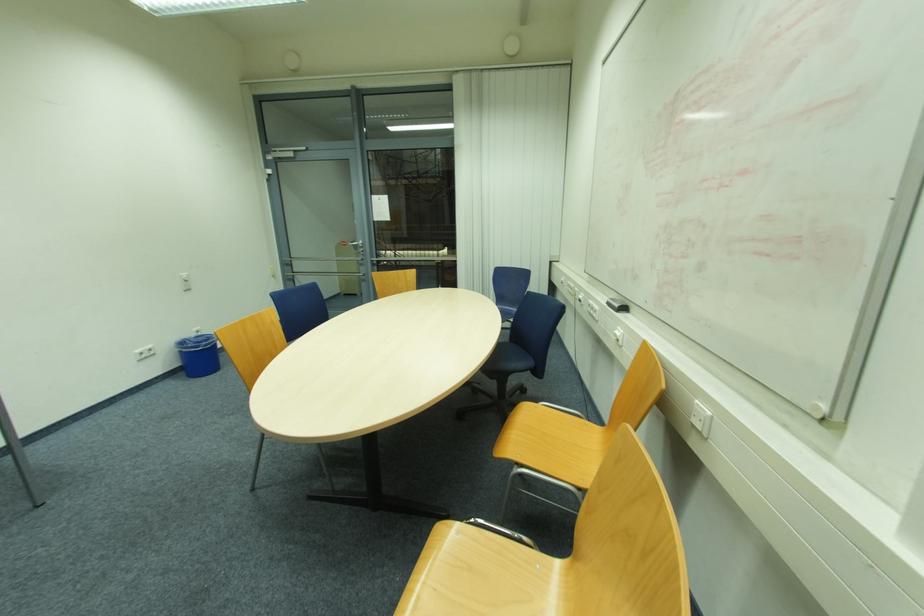
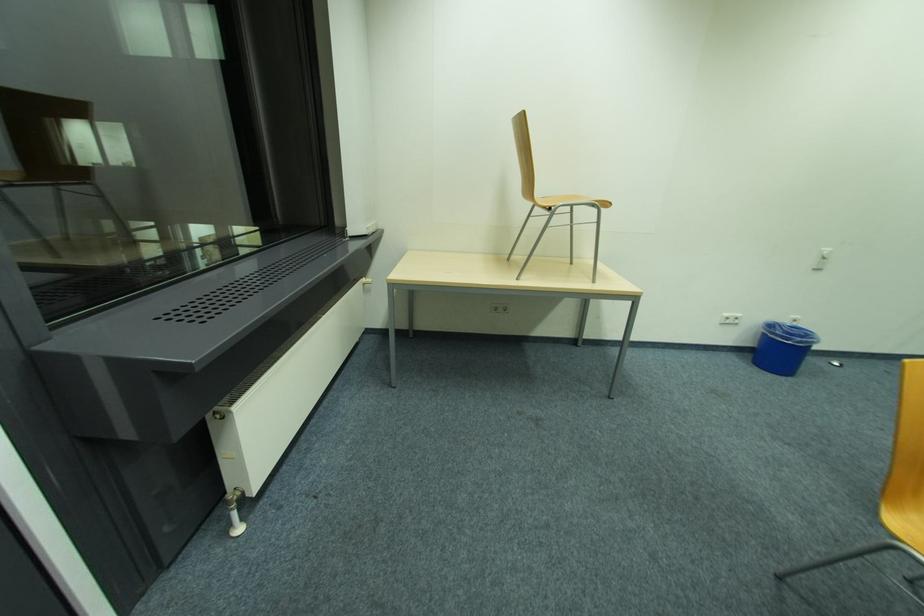
The images are taken continuously from a first-person perspective. In which direction is your viewpoint rotating?

The camera rotated toward left-down.